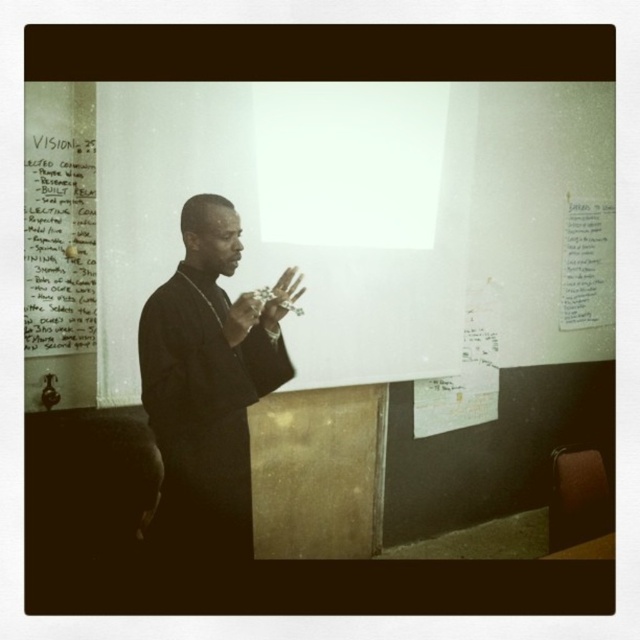
You are an assistant who needs to place a new sticky note on the whiteboard. The whiteboard has the white paper at upper left and the white matte hand at center. Which object has enough space to place the sticky note?

The white paper at upper left is bigger than the white matte hand at center, so placing the sticky note on the white paper at upper left would provide more space.

You are an attendee at a presentation and want to see the presenter clearly. The presenter is wearing a black matte suit at center and has a smooth skin hand at center. Which part of the presenter is closer to you?

The black matte suit at center is closer to you because it is further to the viewer than the smooth skin hand at center, meaning the hand is actually farther away.